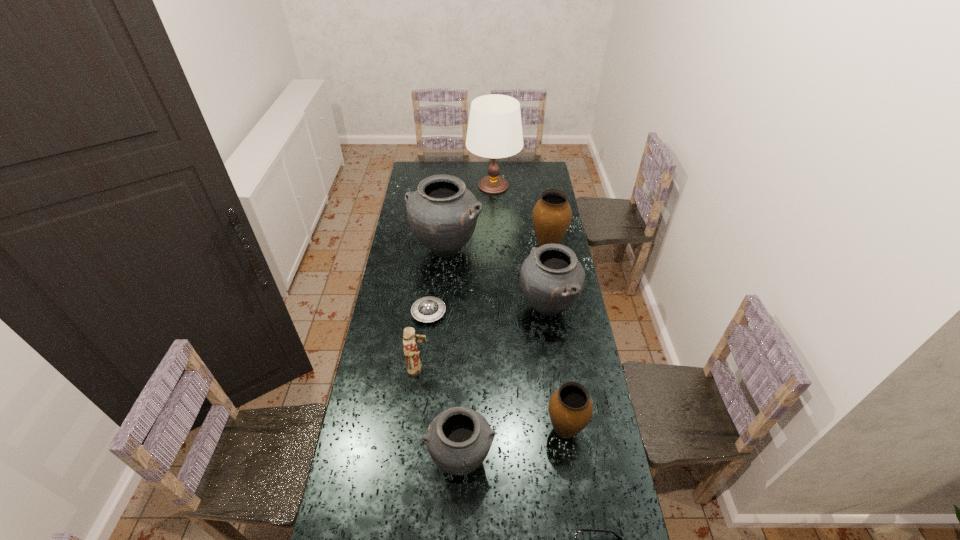
In order to click on gray saucer in this screenshot , I will do `click(427, 309)`.

Locate an element on the screen. The image size is (960, 540). the eighth tallest object is located at coordinates (427, 309).

The height and width of the screenshot is (540, 960). Find the location of `vacant region located on the left of the lamp`. vacant region located on the left of the lamp is located at coordinates tap(425, 186).

Where is `vacant area situated 0.220m on the front of the tallest urn`? This screenshot has height=540, width=960. vacant area situated 0.220m on the front of the tallest urn is located at coordinates [442, 306].

Locate an element on the screen. This screenshot has height=540, width=960. vacant region located on the front of the farther brown urn is located at coordinates (561, 321).

You are a GUI agent. You are given a task and a screenshot of the screen. Output one action in this format:
    pyautogui.click(x=<x>, y=<y>)
    Task: Click on the vacant region located on the front of the third nearest urn
    The width and height of the screenshot is (960, 540).
    Given the screenshot: What is the action you would take?
    pyautogui.click(x=558, y=371)

Find the location of a particular element. vacant area located on the front-facing side of the sixth farthest object is located at coordinates pyautogui.click(x=496, y=369).

This screenshot has height=540, width=960. I want to click on free space located on the left of the smaller brown urn, so click(469, 430).

Find the location of `blank area located on the back of the smallest black urn`. blank area located on the back of the smallest black urn is located at coordinates (464, 367).

Image resolution: width=960 pixels, height=540 pixels. Find the location of `free spot located 0.090m on the back of the gray saucer`. free spot located 0.090m on the back of the gray saucer is located at coordinates (432, 286).